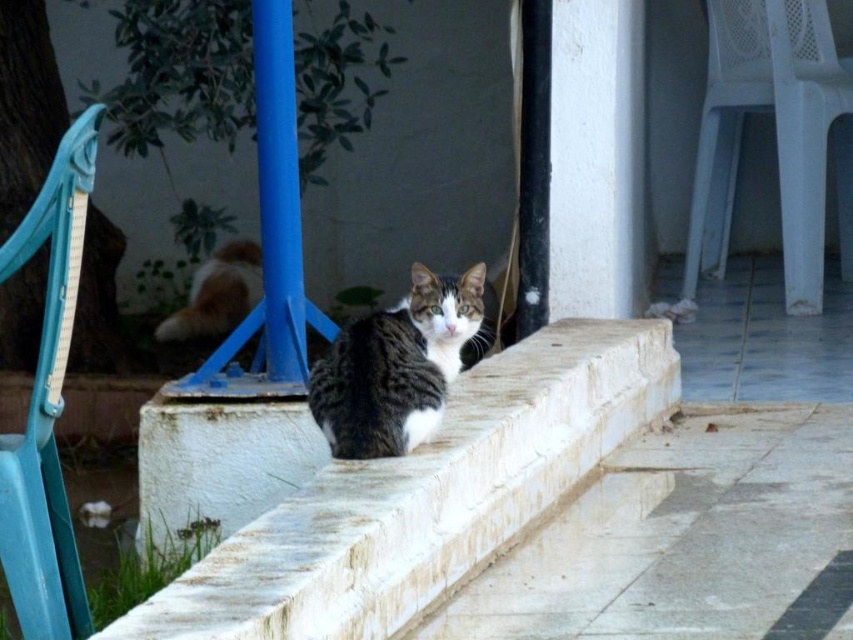
You are a small toy that is 10 cm tall. You want to jump from the white stone ledge at center to the white stone steps at center. Is this possible?

The white stone ledge at center is much taller than white stone steps at center, so the jump might be too high for the toy to safely make the leap.